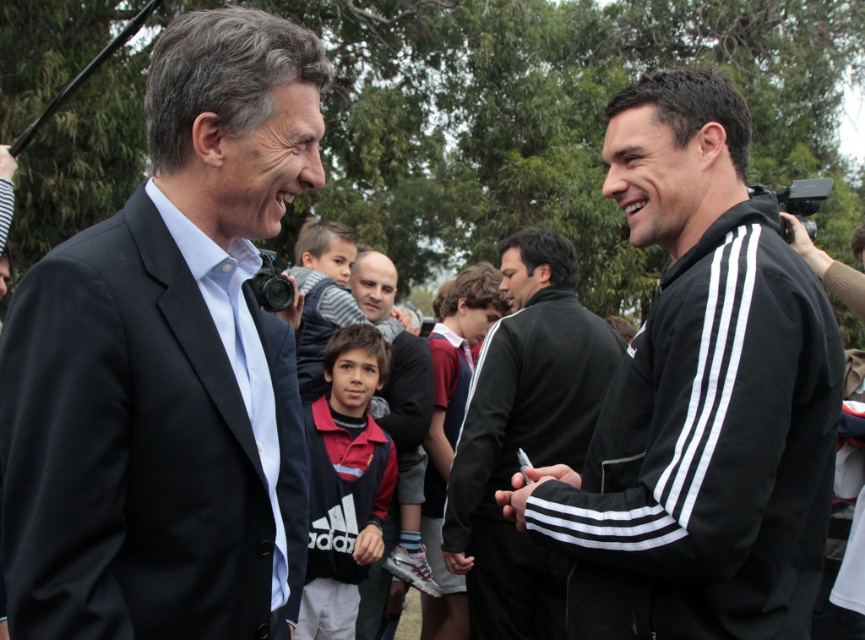
You are at the event and want to locate the black matte jacket at center. Where exactly is it positioned in the image?

The black matte jacket at center is located at point coordinates of 0.680 on the x axis and 0.607 on the y axis.

You are a photographer at a public event. You want to capture a photo of the black adidas tracksuit at right and dark brown leather jacket at center together in the frame. Given that your camera has a maximum focus range of 3 meters, will both subjects be in focus?

The distance between the black adidas tracksuit at right and dark brown leather jacket at center is 3.29 meters. Since the camera can only focus up to 3 meters, the subjects are slightly out of the focus range. Therefore, they might not both be in focus.